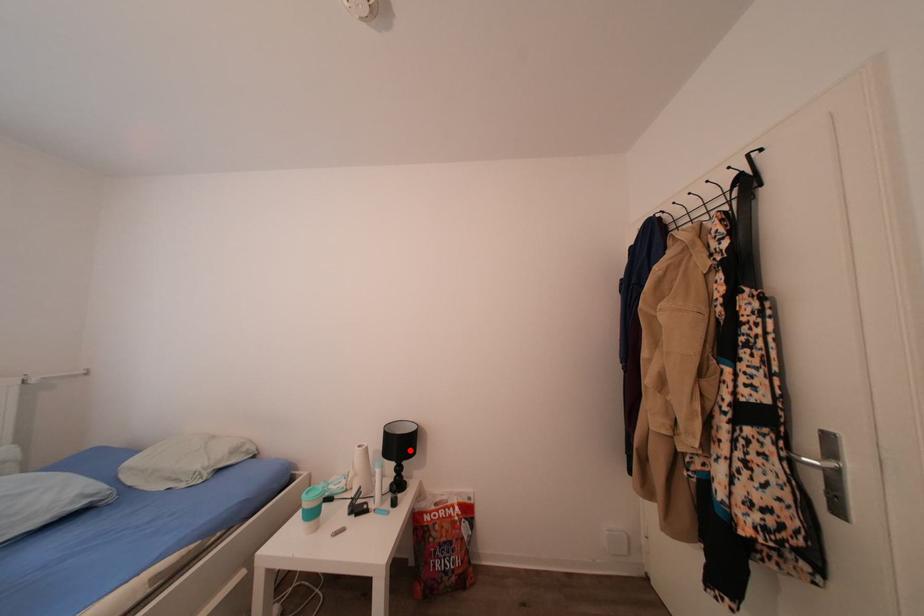
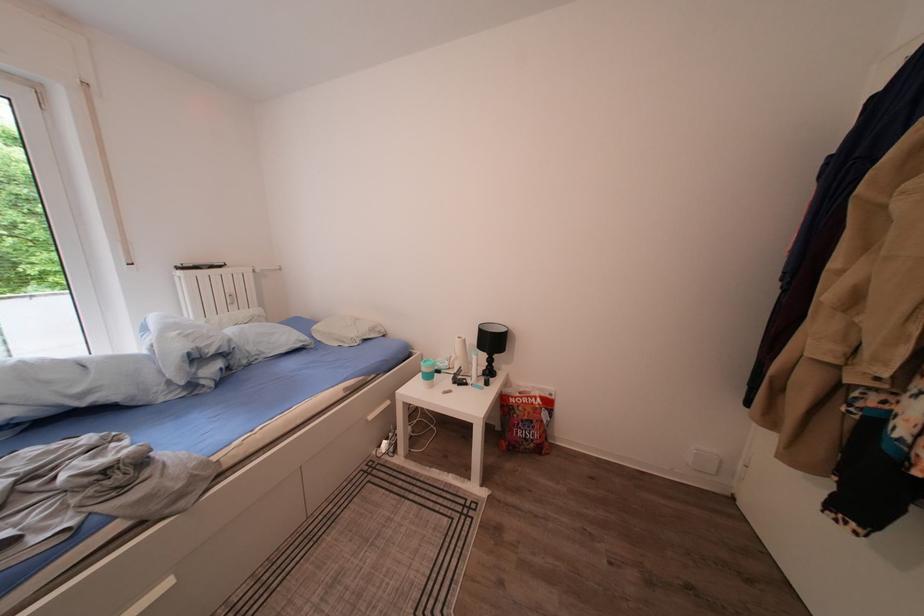
The point at the highlighted location is marked in the first image. Where is the corresponding point in the second image?

(502, 347)